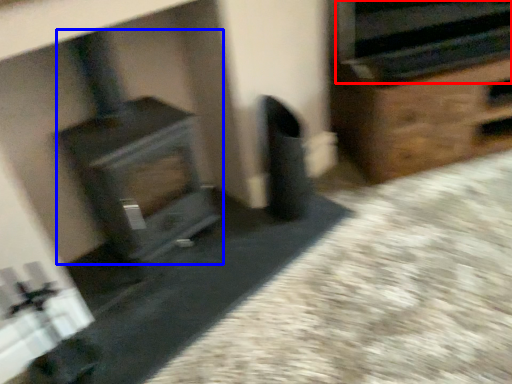
Question: Which of the following is the farthest to the observer, stereo (highlighted by a red box) or wood burning stove (highlighted by a blue box)?

Choices:
 (A) stereo
 (B) wood burning stove

Answer: (A)